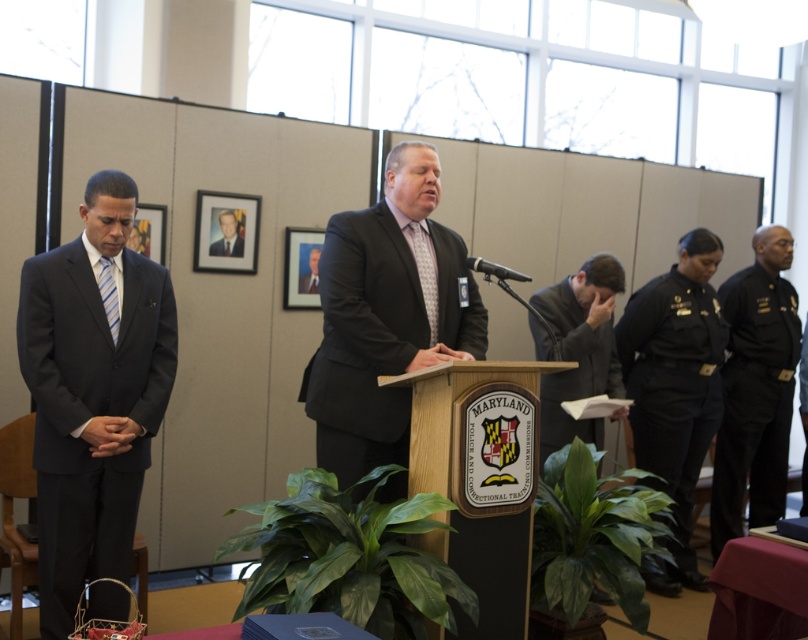
Question: Is matte black suit at center in front of smooth black suit at center?

Choices:
 (A) yes
 (B) no

Answer: (A)

Question: Which of the following is the farthest from the observer?

Choices:
 (A) pos(495,266)
 (B) pos(230,256)
 (C) pos(720,474)
 (D) pos(326,454)

Answer: (C)

Question: Which object appears closest to the camera in this image?

Choices:
 (A) matte black suit at center
 (B) black uniform at right
 (C) dark gray suit at center
 (D) formal black suit at upper center

Answer: (A)

Question: Can you confirm if matte black suit at center is wider than blue striped tie at left?

Choices:
 (A) yes
 (B) no

Answer: (A)

Question: Considering the real-world distances, which object is farthest from the black uniform pants at right?

Choices:
 (A) dark gray suit at left
 (B) matte black suit at center
 (C) black plastic microphone at center

Answer: (A)

Question: From the image, what is the correct spatial relationship of black uniform pants at right in relation to gray suit jacket at center?

Choices:
 (A) left
 (B) right

Answer: (B)